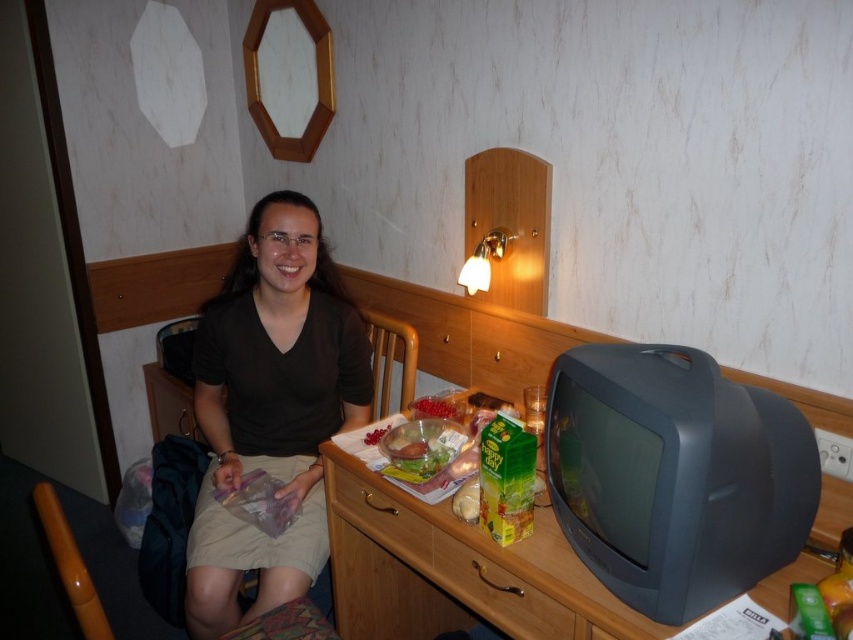
You are organizing items in the room and need to place a new item on the wooden table at lower right. To ensure it doesn not block the wooden drawer at lower center, where should you position it?

Since the wooden table at lower right is to the right of the wooden drawer at lower center, you should place the new item on the left side of the wooden table at lower right to avoid blocking the wooden drawer at lower center.

You are a delivery person who needs to place a package on the desk. The package is the same size as the wooden drawer at lower center. Can you fit another item of the same size as the matte black shirt at center on the desk without moving anything else?

The matte black shirt at center is larger in size than the wooden drawer at lower center. Since the package is the same size as the wooden drawer, the space required for the new item would be bigger than the available remaining space. Therefore, you cannot fit another item of the same size as the matte black shirt at center on the desk without moving anything else.

You are a delivery person who needs to place a package on the wooden table at lower right. However, there is a wooden drawer at lower center in the way. Can you slide the package from the drawer to the table without moving the drawer?

The wooden table at lower right and wooden drawer at lower center are 3.93 centimeters apart from each other. Since the distance between them is only 3.93 cm, it would be difficult to slide the package from the drawer to the table without moving the drawer, as there isn not enough space between them for the package to pass through.